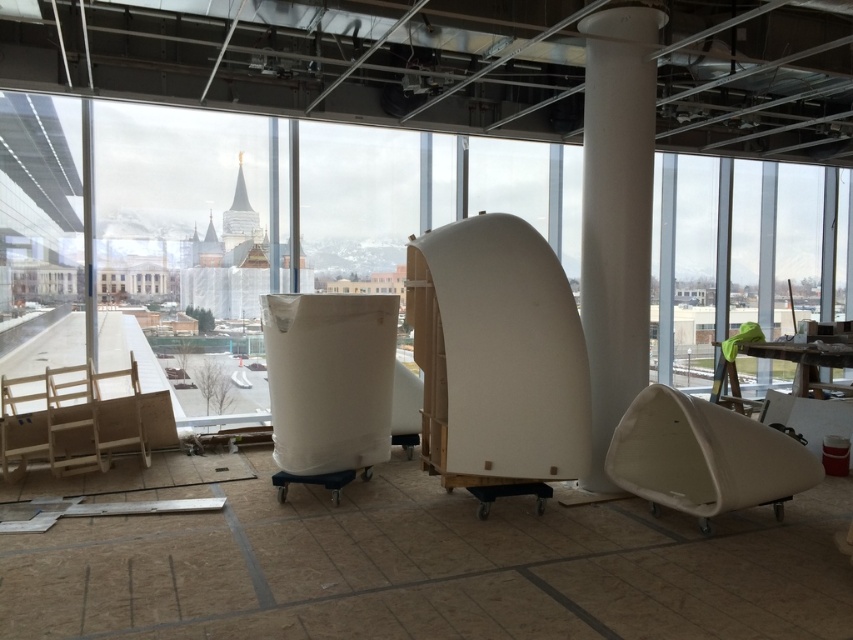
You are an interior designer standing in the room and need to move a large piece of furniture from the white smooth column at center to the white matte chair at lower right. Which direction should you move it to avoid obstacles?

The white smooth column at center is to the left of the white matte chair at lower right, so you should move the furniture to the right to avoid obstacles.

You are arranging chairs in the indoor space. You have a white matte chair at lower right and a wooden chair at left. Which chair is closer to the right side of the room?

The white matte chair at lower right is positioned on the right side of the wooden chair at left, so it is closer to the right side of the room.

You are a delivery person who needs to place a package on the tallest chair in the room. Which chair should you choose between the white matte chair at lower right and the wooden chair at left?

The white matte chair at lower right has a greater height compared to the wooden chair at left, so you should place the package on the white matte chair at lower right.